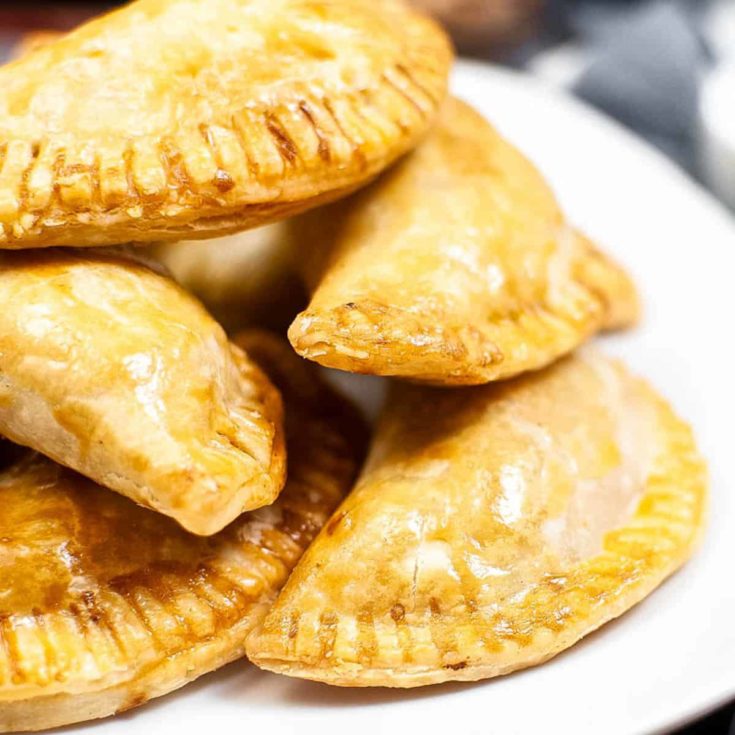
Find the location of a particular element. The width and height of the screenshot is (735, 735). white plate is located at coordinates (677, 278).